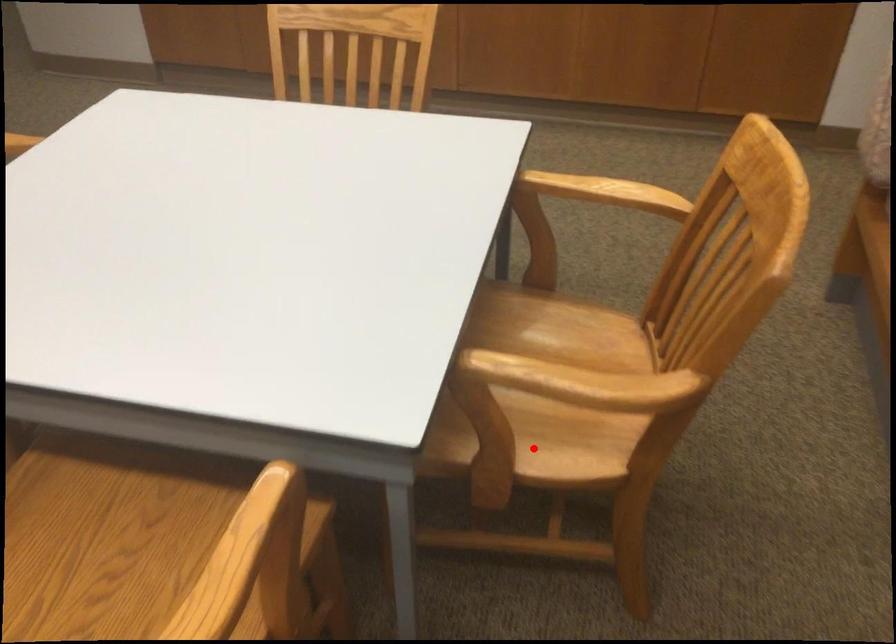
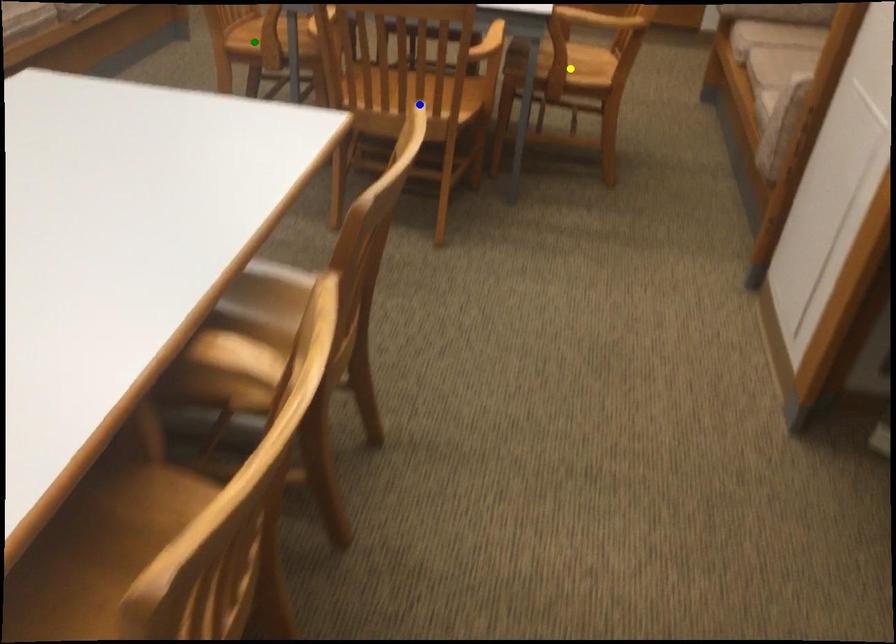
Question: I am providing you with two images of the same scene from different viewpoints. A red point is marked on the first image. You are given multiple points on the second image. Which spot in image 2 lines up with the point in image 1?

Choices:
 (A) blue point
 (B) green point
 (C) yellow point

Answer: (C)